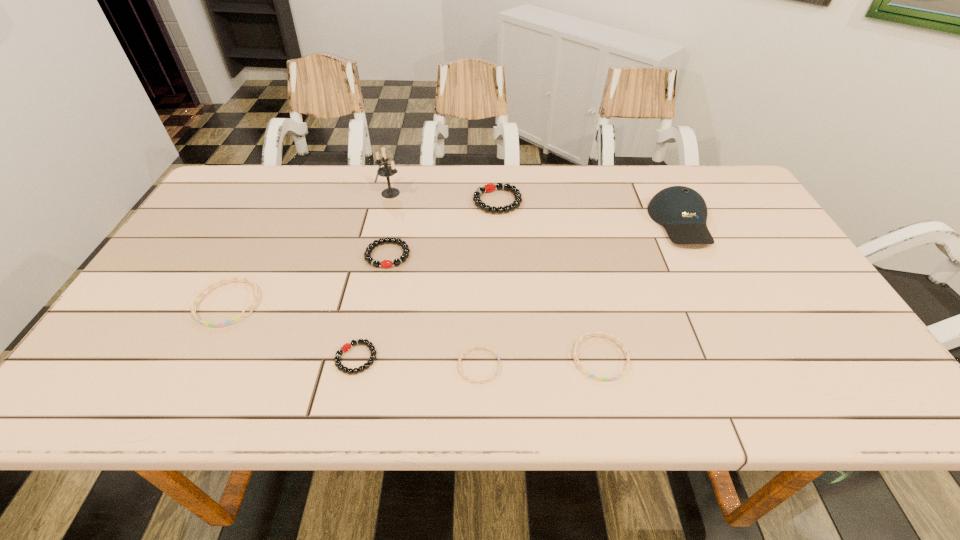
The height and width of the screenshot is (540, 960). Identify the location of the second object from right to left. (626, 352).

Locate an element on the screen. Image resolution: width=960 pixels, height=540 pixels. the smallest black bracelet is located at coordinates (347, 346).

Where is `the shortest object`? Image resolution: width=960 pixels, height=540 pixels. the shortest object is located at coordinates (476, 347).

At what (x,y) coordinates should I click in order to perform the action: click on the smallest blue bracelet. Please return your answer as a coordinate pair (x, y). Looking at the image, I should click on (476, 347).

What are the coordinates of `free point located 0.280m on the front of the candle holder` in the screenshot? It's located at (373, 265).

At what (x,y) coordinates should I click in order to perform the action: click on vacant space located 0.050m on the front-facing side of the rightmost object. Please return your answer as a coordinate pair (x, y). Image resolution: width=960 pixels, height=540 pixels. Looking at the image, I should click on (702, 265).

Find the location of a particular element. Image resolution: width=960 pixels, height=540 pixels. free space located 0.170m on the front of the rightmost black bracelet is located at coordinates (500, 256).

Identify the location of free region located on the surface of the fifth farthest object showing star-shaped elements. Image resolution: width=960 pixels, height=540 pixels. (198, 362).

The width and height of the screenshot is (960, 540). Identify the location of free space located 0.260m on the right of the fifth nearest bracelet. (509, 255).

The image size is (960, 540). In order to click on vacant space located 0.150m on the right of the nearest black bracelet in this screenshot , I will do `click(447, 358)`.